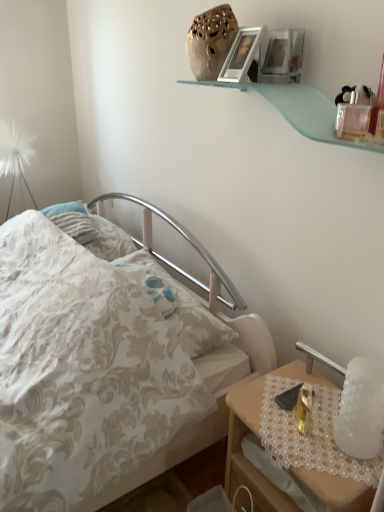
At what (x,y) coordinates should I click in order to perform the action: click on vacant area on the back side of white frosted glass bedside lamp at right. Please return your answer as a coordinate pair (x, y). The image size is (384, 512). Looking at the image, I should click on (312, 394).